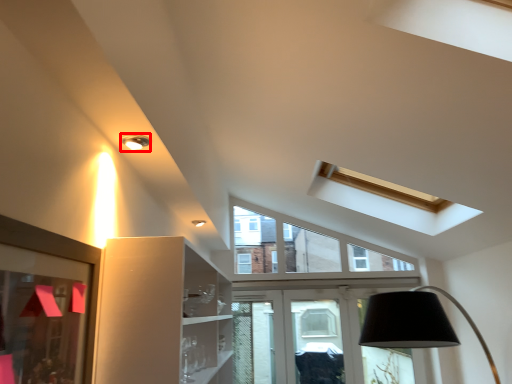
Question: From the image, what is the correct spatial relationship of light fixture (annotated by the red box) in relation to picture frame?

Choices:
 (A) right
 (B) left

Answer: (A)